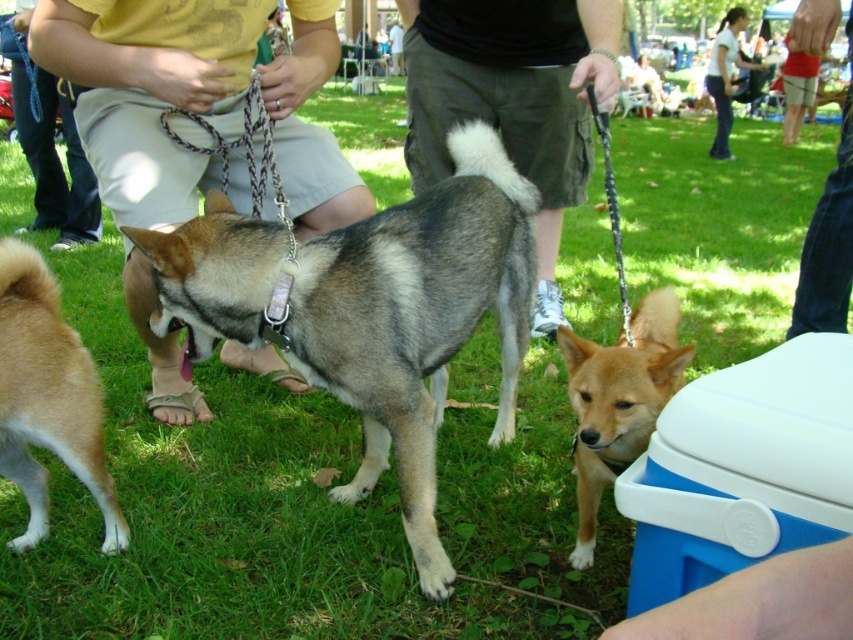
Question: Which point is closer to the camera?

Choices:
 (A) dark gray shorts at center
 (B) light brown fur at lower left

Answer: (B)

Question: Is dark gray shorts at center behind white cotton shirt at upper right?

Choices:
 (A) no
 (B) yes

Answer: (A)

Question: Which object appears farthest from the camera in this image?

Choices:
 (A) jeans at lower right
 (B) yellow t-shirt at center
 (C) gray-furred dog at center

Answer: (A)

Question: Considering the relative positions of jeans at lower right and white cotton shirt at upper right in the image provided, where is jeans at lower right located with respect to white cotton shirt at upper right?

Choices:
 (A) below
 (B) above

Answer: (A)

Question: Is light brown fur at lower left bigger than denim pants at lower left?

Choices:
 (A) yes
 (B) no

Answer: (B)

Question: Based on their relative distances, which object is nearer to the jeans at lower right?

Choices:
 (A) denim pants at lower left
 (B) light brown fur at lower left

Answer: (A)